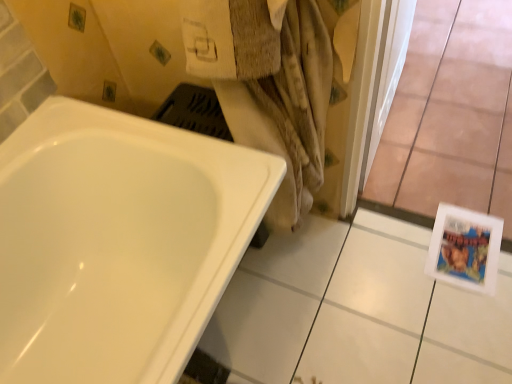
Locate an element on the screen. This screenshot has width=512, height=384. transparent glass door at lower right is located at coordinates (451, 116).

You are a GUI agent. You are given a task and a screenshot of the screen. Output one action in this format:
    pyautogui.click(x=<x>, y=<y>)
    Task: Click on the beige textured towel at center
    The width and height of the screenshot is (512, 384).
    Given the screenshot: What is the action you would take?
    pyautogui.click(x=288, y=111)

This screenshot has width=512, height=384. In order to click on transparent glass door at lower right in this screenshot , I will do `click(451, 116)`.

Is transparent glass door at lower right inside white glossy bathtub at lower left?

No, transparent glass door at lower right is not surrounded by white glossy bathtub at lower left.

In order to click on glass door on the right of white glossy bathtub at lower left in this screenshot , I will do `click(451, 116)`.

Is white glossy bathtub at lower left positioned far away from transparent glass door at lower right?

Indeed, white glossy bathtub at lower left is not near transparent glass door at lower right.

Is white glossy bathtub at lower left looking in the opposite direction of transparent glass door at lower right?

No, white glossy bathtub at lower left is not facing away from transparent glass door at lower right.

Is white glossy tile at lower right far away from transparent glass door at lower right?

That's not correct — white glossy tile at lower right is a little close to transparent glass door at lower right.

Is white glossy tile at lower right to the right of transparent glass door at lower right from the viewer's perspective?

In fact, white glossy tile at lower right is to the left of transparent glass door at lower right.

How different are the orientations of white glossy tile at lower right and transparent glass door at lower right in degrees?

They differ by 180 degrees in their facing directions.

Is point (326, 325) closer to camera compared to point (457, 23)?

Yes, point (326, 325) is in front of point (457, 23).

Is transparent glass door at lower right in contact with white glossy bathtub at lower left?

They are not placed beside each other.

Visually, is transparent glass door at lower right positioned to the left or to the right of white glossy bathtub at lower left?

transparent glass door at lower right is to the right of white glossy bathtub at lower left.

From the image's perspective, is transparent glass door at lower right under white glossy bathtub at lower left?

Actually, transparent glass door at lower right appears above white glossy bathtub at lower left in the image.

In order to click on ceramic tile below the beige textured towel at center (from a real-world perspective) in this screenshot , I will do `click(357, 311)`.

Between point (290, 173) and point (377, 294), which one is positioned in front?

The point (290, 173) is closer to the camera.

What's the angular difference between beige textured towel at center and white glossy tile at lower right's facing directions?

180 degrees.

Based on the photo, is white glossy tile at lower right at the back of beige textured towel at center?

That's not correct — beige textured towel at center is not looking away from white glossy tile at lower right.

Between transparent glass door at lower right and white glossy tile at lower right, which one has larger size?

transparent glass door at lower right is bigger.

Based on their positions, is transparent glass door at lower right located to the left or right of white glossy tile at lower right?

From the image, it's evident that transparent glass door at lower right is to the right of white glossy tile at lower right.

From a real-world perspective, between transparent glass door at lower right and white glossy tile at lower right, who is vertically lower?

From a 3D spatial view, white glossy tile at lower right is below.

In the scene shown: Is transparent glass door at lower right positioned with its back to beige textured towel at center?

No, beige textured towel at center is not at the back of transparent glass door at lower right.

Can you tell me how much transparent glass door at lower right and beige textured towel at center differ in facing direction?

The angle between the facing direction of transparent glass door at lower right and the facing direction of beige textured towel at center is 5.25e-05 degrees.

Is transparent glass door at lower right placed right next to beige textured towel at center?

There is a gap between transparent glass door at lower right and beige textured towel at center.

Does transparent glass door at lower right have a greater height compared to beige textured towel at center?

No.

Is point (287, 190) positioned before point (452, 80)?

Yes, it is.

Can you confirm if beige textured towel at center is shorter than transparent glass door at lower right?

Incorrect, the height of beige textured towel at center does not fall short of that of transparent glass door at lower right.

Is beige textured towel at center placed right next to transparent glass door at lower right?

No, beige textured towel at center is not in contact with transparent glass door at lower right.

Where is `bathtub lying below the transparent glass door at lower right (from the image's perspective)`? Image resolution: width=512 pixels, height=384 pixels. bathtub lying below the transparent glass door at lower right (from the image's perspective) is located at coordinates (117, 242).

Locate an element on the screen. glass door above the white glossy tile at lower right (from a real-world perspective) is located at coordinates (451, 116).

From the image, which object appears to be farther from white glossy tile at lower right, beige textured towel at center or transparent glass door at lower right?

transparent glass door at lower right.

When comparing their distances from beige textured towel at center, does white glossy bathtub at lower left or transparent glass door at lower right seem further?

transparent glass door at lower right is further to beige textured towel at center.

In the scene shown: Which object lies nearer to the anchor point beige textured towel at center, white glossy bathtub at lower left or white glossy tile at lower right?

The object closer to beige textured towel at center is white glossy bathtub at lower left.

Looking at the image, which one is located further to white glossy tile at lower right, transparent glass door at lower right or beige textured towel at center?

transparent glass door at lower right.

Looking at the image, which one is located further to beige textured towel at center, white glossy tile at lower right or white glossy bathtub at lower left?

white glossy tile at lower right.

Looking at the image, which one is located further to white glossy tile at lower right, beige textured towel at center or white glossy bathtub at lower left?

Among the two, white glossy bathtub at lower left is located further to white glossy tile at lower right.

Which object lies nearer to the anchor point transparent glass door at lower right, white glossy tile at lower right or white glossy bathtub at lower left?

The object closer to transparent glass door at lower right is white glossy tile at lower right.

Considering their positions, is transparent glass door at lower right positioned closer to beige textured towel at center than white glossy tile at lower right?

The object closer to beige textured towel at center is white glossy tile at lower right.

Find the location of a particular element. bath towel between white glossy bathtub at lower left and white glossy tile at lower right from left to right is located at coordinates (288, 111).

This screenshot has width=512, height=384. Identify the location of ceramic tile between white glossy bathtub at lower left and transparent glass door at lower right from left to right. (357, 311).

At what (x,y) coordinates should I click in order to perform the action: click on bath towel situated between white glossy bathtub at lower left and transparent glass door at lower right from left to right. Please return your answer as a coordinate pair (x, y). This screenshot has height=384, width=512. Looking at the image, I should click on (288, 111).

You are a GUI agent. You are given a task and a screenshot of the screen. Output one action in this format:
    pyautogui.click(x=<x>, y=<y>)
    Task: Click on the bath towel between transparent glass door at lower right and white glossy tile at lower right vertically
    
    Given the screenshot: What is the action you would take?
    pyautogui.click(x=288, y=111)